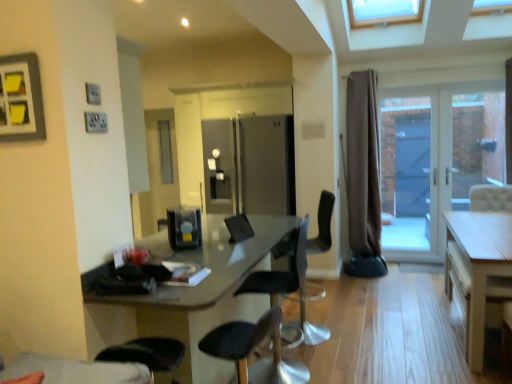
Question: Based on their sizes in the image, would you say white glossy door at right is bigger or smaller than light wood table at right?

Choices:
 (A) big
 (B) small

Answer: (B)

Question: From a real-world perspective, relative to light wood table at right, is white glossy door at right vertically above or below?

Choices:
 (A) below
 (B) above

Answer: (B)

Question: Based on their relative distances, which object is nearer to the white glossy door at right?

Choices:
 (A) black leather chair at center, the third chair in the back-to-front sequence
 (B) matte gray picture frame at upper left
 (C) satin black coffee machine at center
 (D) black plastic chair at center, placed as the 2th chair when sorted from back to front
 (E) light wood table at right

Answer: (E)

Question: Estimate the real-world distances between objects in this image. Which object is closer to the light wood table at right?

Choices:
 (A) black plastic chair at center, which is counted as the 2th chair, starting from the front
 (B) white glossy door at right
 (C) matte gray picture frame at upper left
 (D) clear glass screen door at right
 (E) satin black coffee machine at center

Answer: (A)